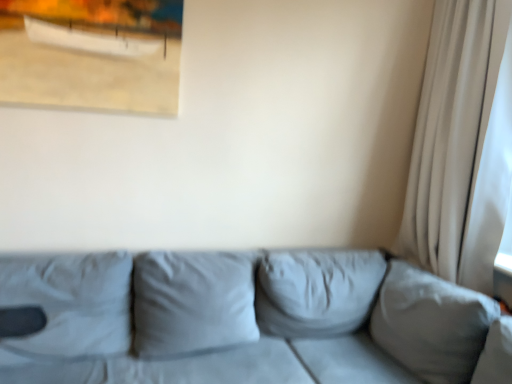
Question: Considering the positions of matte wooden picture frame at upper left and suede gray couch at center in the image, is matte wooden picture frame at upper left wider or thinner than suede gray couch at center?

Choices:
 (A) wide
 (B) thin

Answer: (B)

Question: Considering the positions of matte wooden picture frame at upper left and suede gray couch at center in the image, is matte wooden picture frame at upper left bigger or smaller than suede gray couch at center?

Choices:
 (A) small
 (B) big

Answer: (A)

Question: Estimate the real-world distances between objects in this image. Which object is farther from the suede gray couch at center?

Choices:
 (A) matte wooden picture frame at upper left
 (B) white sheer curtain at right

Answer: (A)

Question: Considering the real-world distances, which object is closest to the white sheer curtain at right?

Choices:
 (A) matte wooden picture frame at upper left
 (B) suede gray couch at center

Answer: (B)